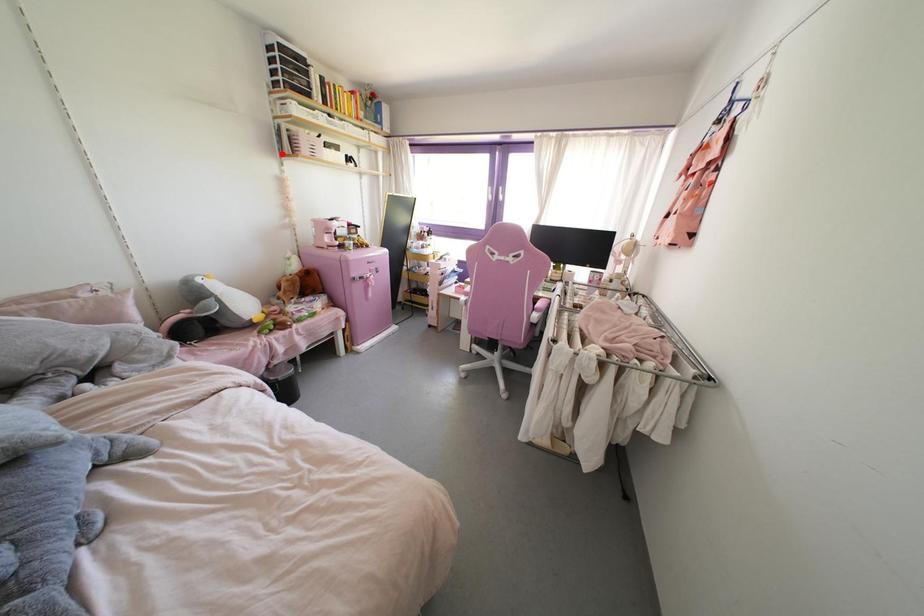
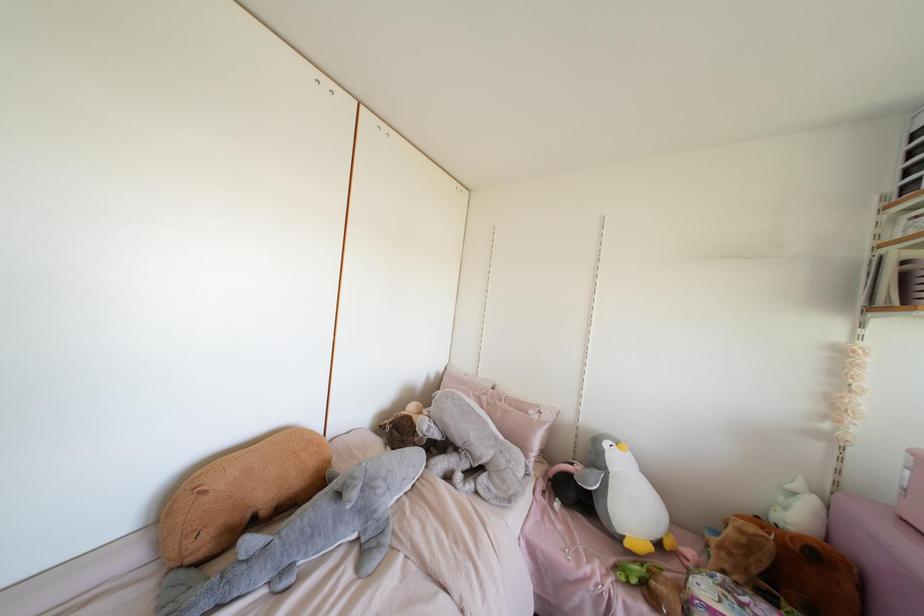
In the second image, find the point that corresponds to the highlighted location in the first image.

(870, 307)